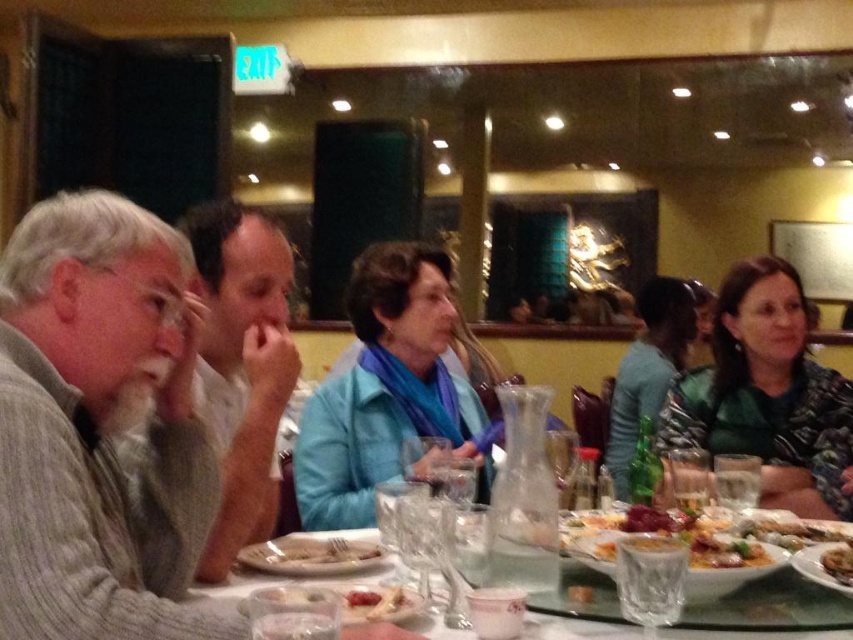
Question: Is white matte shirt at center below translucent plastic bag at center?

Choices:
 (A) no
 (B) yes

Answer: (A)

Question: Considering the relative positions of white matte shirt at center and clear glass tableware at center in the image provided, where is white matte shirt at center located with respect to clear glass tableware at center?

Choices:
 (A) below
 (B) above

Answer: (B)

Question: Which object is the closest to the white glossy bread at center?

Choices:
 (A) white matte shirt at center
 (B) golden brown bread at center
 (C) clear glass tableware at center

Answer: (A)

Question: Estimate the real-world distances between objects in this image. Which object is closer to the golden brown bread at center?

Choices:
 (A) white glossy bread at center
 (B) gray knitted sweater at left
 (C) translucent plastic bag at center

Answer: (C)

Question: Which is farther from the translucent plastic bag at center?

Choices:
 (A) white glossy bread at center
 (B) golden crispy pastry at center
 (C) white matte shirt at center
 (D) gray knitted sweater at left

Answer: (B)

Question: In this image, where is golden brown bread at center located relative to translucent plastic bag at center?

Choices:
 (A) left
 (B) right

Answer: (B)